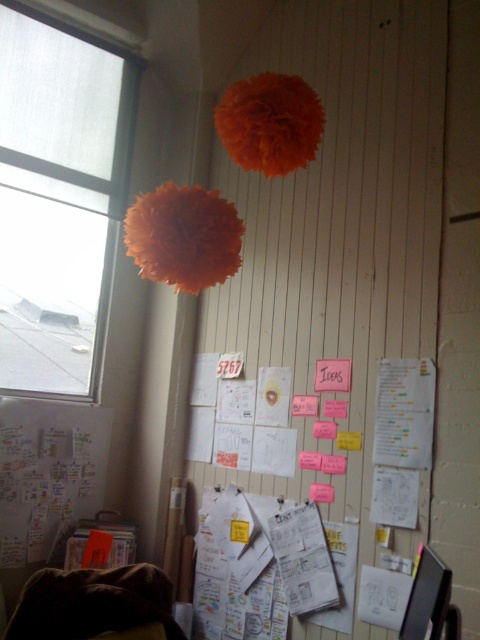
Question: Which object is the closest to the transparent glass window at upper left?

Choices:
 (A) white paper at lower left
 (B) brown fuzzy blanket at lower left
 (C) yellow paper at center

Answer: (A)

Question: Does brown fuzzy blanket at lower left lie in front of yellow paper at center?

Choices:
 (A) yes
 (B) no

Answer: (A)

Question: Which object appears farthest from the camera in this image?

Choices:
 (A) yellow paper at center
 (B) brown fuzzy blanket at lower left
 (C) transparent glass window at upper left
 (D) white paper at lower left

Answer: (C)

Question: Among these points, which one is nearest to the camera?

Choices:
 (A) (165, 627)
 (B) (37, 202)
 (C) (76, 428)

Answer: (A)

Question: Is brown fuzzy blanket at lower left to the left of yellow paper at center from the viewer's perspective?

Choices:
 (A) yes
 (B) no

Answer: (A)

Question: Can you confirm if white paper at lower left is thinner than brown fuzzy blanket at lower left?

Choices:
 (A) yes
 (B) no

Answer: (A)